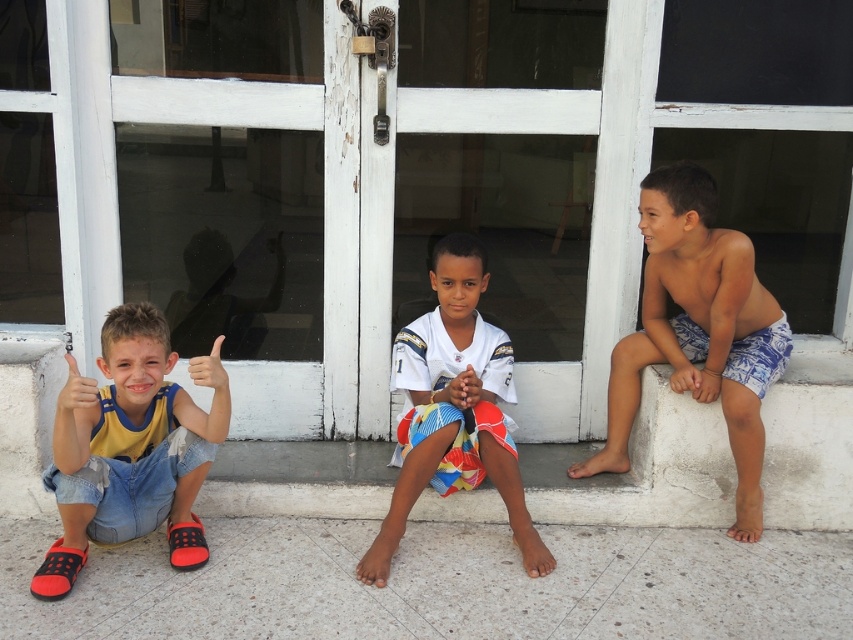
Question: Estimate the real-world distances between objects in this image. Which object is farther from the denim shorts at left?

Choices:
 (A) blue printed shorts at right
 (B) white jersey at center

Answer: (A)

Question: Can you confirm if blue printed shorts at right is wider than denim shorts at left?

Choices:
 (A) yes
 (B) no

Answer: (A)

Question: Does blue printed shorts at right have a larger size compared to white jersey at center?

Choices:
 (A) no
 (B) yes

Answer: (B)

Question: Is blue printed shorts at right thinner than denim shorts at left?

Choices:
 (A) yes
 (B) no

Answer: (B)

Question: Considering the real-world distances, which object is closest to the denim shorts at left?

Choices:
 (A) white jersey at center
 (B) blue printed shorts at right

Answer: (A)

Question: Estimate the real-world distances between objects in this image. Which object is closer to the denim shorts at left?

Choices:
 (A) white jersey at center
 (B) blue printed shorts at right

Answer: (A)